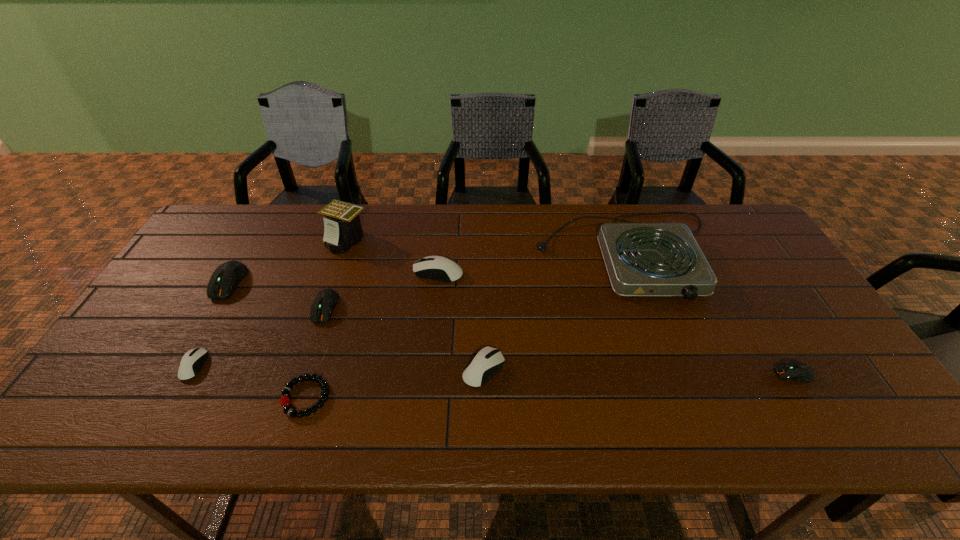
Where is `computer equipment located at the right edge`? The width and height of the screenshot is (960, 540). computer equipment located at the right edge is located at coordinates (798, 371).

Where is `object at the far right corner`? This screenshot has height=540, width=960. object at the far right corner is located at coordinates (642, 259).

In the image, there is a desktop. In order to click on vacant space at the far edge in this screenshot , I will do `click(644, 208)`.

You are a GUI agent. You are given a task and a screenshot of the screen. Output one action in this format:
    pyautogui.click(x=<x>, y=<y>)
    Task: Click on the vacant area at the near edge
    
    Given the screenshot: What is the action you would take?
    pyautogui.click(x=163, y=427)

Locate an element on the screen. This screenshot has height=540, width=960. vacant space at the left edge of the desktop is located at coordinates (148, 372).

Image resolution: width=960 pixels, height=540 pixels. In the image, there is a desktop. Find the location of `vacant space at the right edge`. vacant space at the right edge is located at coordinates point(777,278).

The height and width of the screenshot is (540, 960). In the image, there is a desktop. Find the location of `vacant space at the near left corner`. vacant space at the near left corner is located at coordinates (109, 417).

This screenshot has height=540, width=960. I want to click on vacant space at the far right corner of the desktop, so click(719, 207).

Where is `blank region between the smallest white mouse and the leftmost dark computer equipment`? This screenshot has width=960, height=540. blank region between the smallest white mouse and the leftmost dark computer equipment is located at coordinates (211, 324).

Find the location of `free spot between the shortest object and the third object from right to left`. free spot between the shortest object and the third object from right to left is located at coordinates (395, 383).